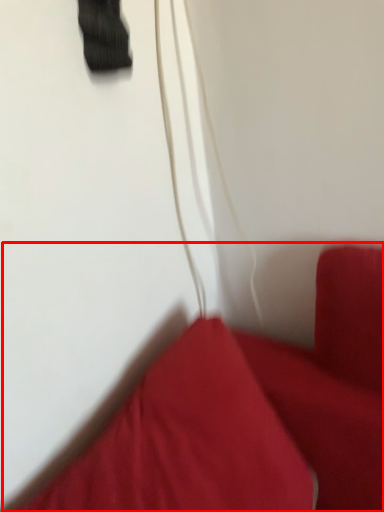
Question: From the image's perspective, what is the correct spatial positioning of furniture (annotated by the red box) in reference to string?

Choices:
 (A) below
 (B) above

Answer: (A)